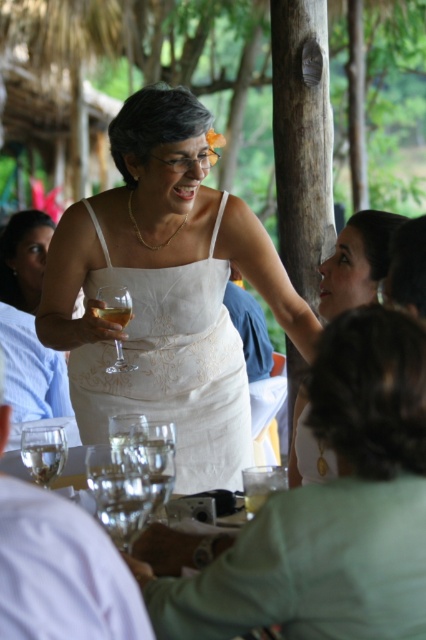
Question: Is matte white dress at center above clear glass wine at center?

Choices:
 (A) yes
 (B) no

Answer: (B)

Question: Among these objects, which one is farthest from the camera?

Choices:
 (A) white lace dress at center
 (B) white satin dress at center
 (C) clear glass wine glass at center

Answer: (B)

Question: Which point is closer to the camera?

Choices:
 (A) (336, 273)
 (B) (176, 260)
 (C) (314, 426)
 (D) (216, 220)

Answer: (C)

Question: Which is farther from the white satin dress at center?

Choices:
 (A) clear glass wine glass at lower left
 (B) clear glass wine at center
 (C) clear glass wine glass at center

Answer: (A)

Question: Does white embroidered dress at center appear on the left side of clear glass wine glass at lower left?

Choices:
 (A) yes
 (B) no

Answer: (B)

Question: Where is clear glass at lower left located in relation to matte white dress at center in the image?

Choices:
 (A) above
 (B) below

Answer: (A)